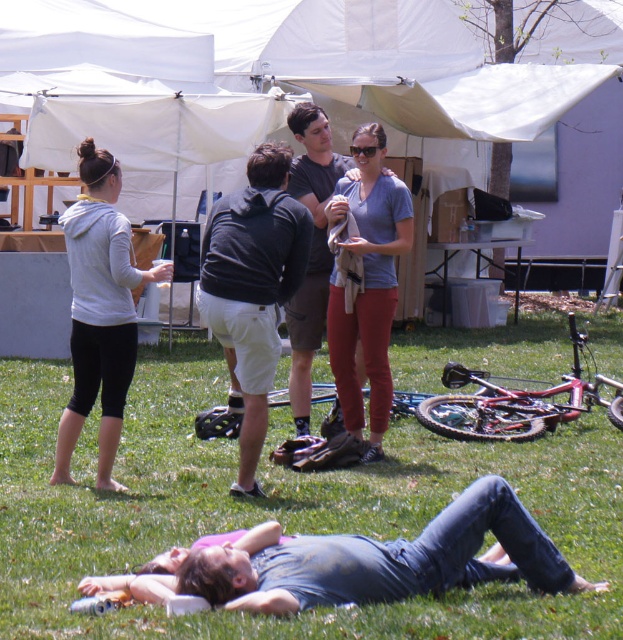
Question: Is green grass at lower center to the right of black cotton hoodie at center from the viewer's perspective?

Choices:
 (A) no
 (B) yes

Answer: (B)

Question: Can you confirm if green grass at lower center is positioned to the left of metallic red bicycle at lower right?

Choices:
 (A) yes
 (B) no

Answer: (A)

Question: Among these objects, which one is farthest from the camera?

Choices:
 (A) black cotton hoodie at center
 (B) white matte hoodie at left
 (C) green grass at lower center
 (D) metallic red bicycle at lower right

Answer: (D)

Question: Among these points, which one is farthest from the camera?

Choices:
 (A) (112, 74)
 (B) (323, 508)
 (C) (376, 148)
 (D) (381, 337)

Answer: (A)

Question: Which of the following is the closest to the observer?

Choices:
 (A) black cotton hoodie at center
 (B) metallic red bicycle at lower right

Answer: (A)

Question: Observing the image, what is the correct spatial positioning of white fabric tent at upper center in reference to matte gray shirt at center?

Choices:
 (A) below
 (B) above

Answer: (B)